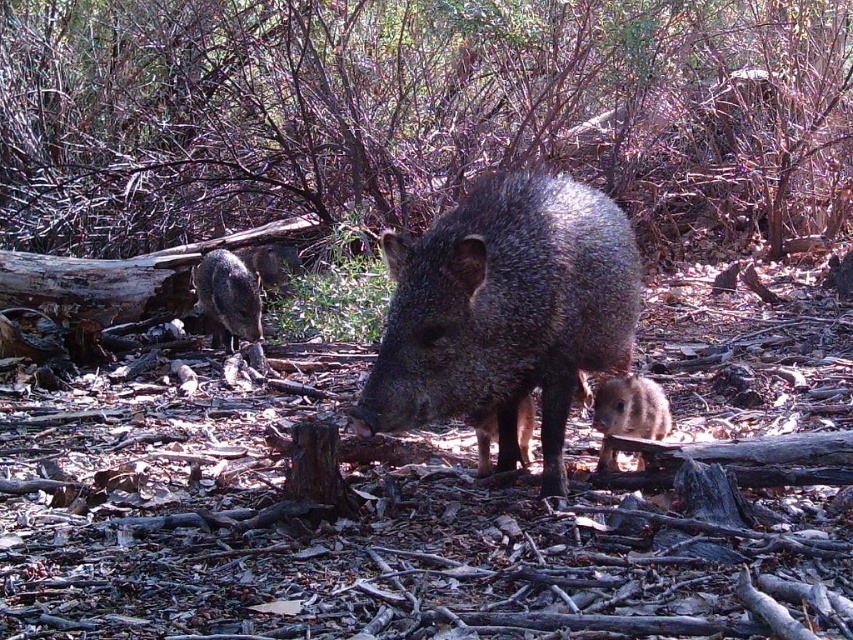
Question: Where is gray speckled piglet at center located in relation to gray speckled piglet at lower left in the image?

Choices:
 (A) right
 (B) left

Answer: (A)

Question: Is gray speckled piglet at center further to the viewer compared to gray speckled piglet at lower left?

Choices:
 (A) no
 (B) yes

Answer: (A)

Question: Can you confirm if gray speckled piglet at center is positioned above gray speckled piglet at lower left?

Choices:
 (A) yes
 (B) no

Answer: (B)